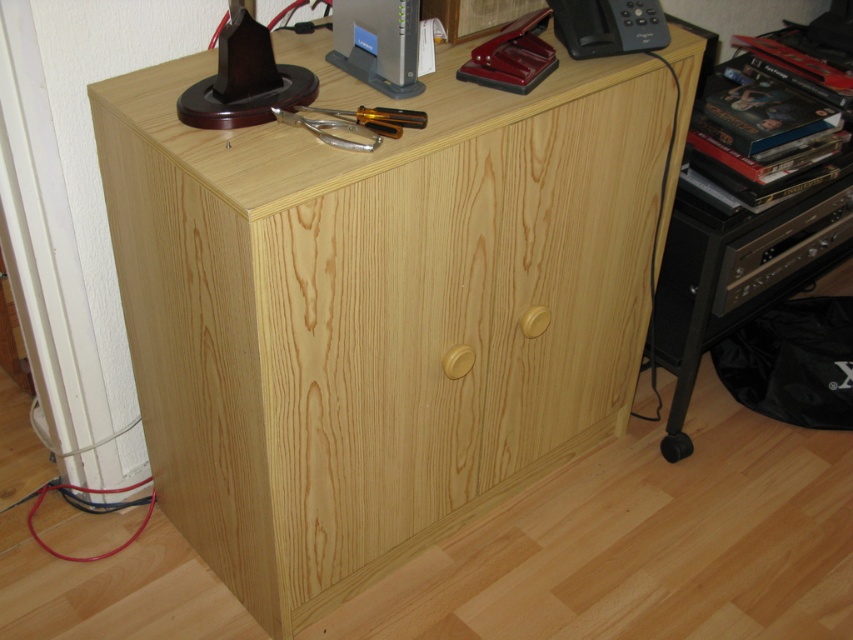
Is natural wood cabinet at center thinner than black plastic telephone at upper right?

No, natural wood cabinet at center is not thinner than black plastic telephone at upper right.

Is point (172, 316) more distant than point (589, 10)?

That is False.

This screenshot has width=853, height=640. In order to click on natural wood cabinet at center in this screenshot , I will do `click(376, 310)`.